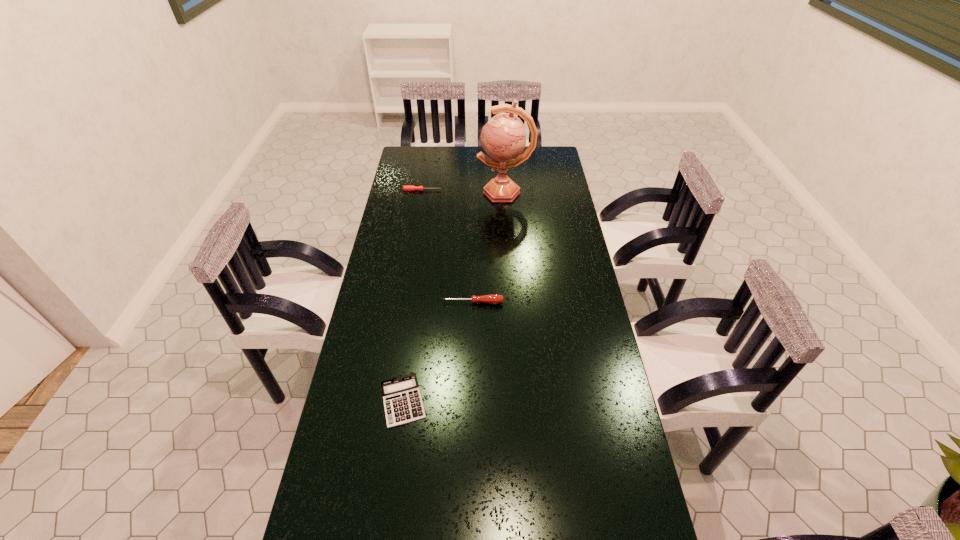
I want to click on free space between the globe and the shorter screwdriver, so click(x=464, y=191).

You are a GUI agent. You are given a task and a screenshot of the screen. Output one action in this format:
    pyautogui.click(x=<x>, y=<y>)
    Task: Click on the vacant space that is in between the calculator and the taller screwdriver
    Image resolution: width=960 pixels, height=540 pixels.
    Given the screenshot: What is the action you would take?
    (x=438, y=352)

The image size is (960, 540). I want to click on free space between the farther screwdriver and the nearest object, so click(413, 296).

You are a GUI agent. You are given a task and a screenshot of the screen. Output one action in this format:
    pyautogui.click(x=<x>, y=<y>)
    Task: Click on the vacant space that is in between the farther screwdriver and the nearest object
    The height and width of the screenshot is (540, 960).
    Given the screenshot: What is the action you would take?
    pyautogui.click(x=413, y=296)

In order to click on vacant area that lies between the farther screwdriver and the tallest object in this screenshot , I will do `click(464, 191)`.

At what (x,y) coordinates should I click in order to perform the action: click on vacant space in between the tallest object and the calculator. Please return your answer as a coordinate pair (x, y). This screenshot has width=960, height=540. Looking at the image, I should click on (454, 296).

At what (x,y) coordinates should I click in order to perform the action: click on empty space that is in between the tallest object and the shorter screwdriver. Please return your answer as a coordinate pair (x, y). Image resolution: width=960 pixels, height=540 pixels. Looking at the image, I should click on pyautogui.click(x=464, y=191).

I want to click on free space between the tallest object and the nearest object, so click(454, 296).

Find the location of a particular element. object that stands as the third closest to the nearer screwdriver is located at coordinates (405, 188).

You are a GUI agent. You are given a task and a screenshot of the screen. Output one action in this format:
    pyautogui.click(x=<x>, y=<y>)
    Task: Click on the object that stands as the third closest to the globe
    This screenshot has width=960, height=540.
    Given the screenshot: What is the action you would take?
    pyautogui.click(x=402, y=400)